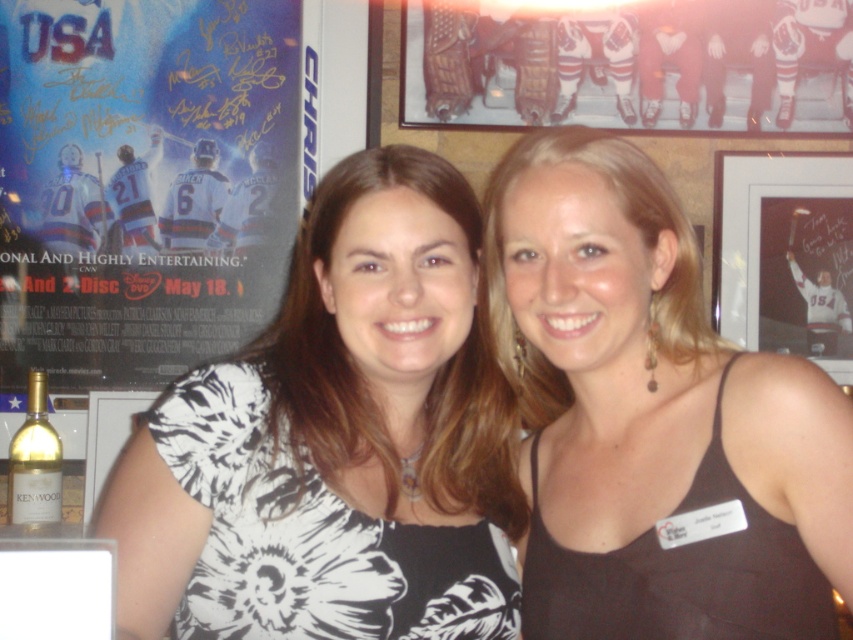
Between point (271, 541) and point (39, 374), which one is positioned in front?

Positioned in front is point (271, 541).

Which of these two, white floral dress at center or gold metallic bottle at lower left, stands taller?

white floral dress at center

The width and height of the screenshot is (853, 640). What are the coordinates of `white floral dress at center` in the screenshot? It's located at (335, 440).

Where is `white floral dress at center`? This screenshot has width=853, height=640. white floral dress at center is located at coordinates (335, 440).

Who is more distant from viewer, [773,499] or [212,188]?

The point [212,188] is behind.

Does point (692, 266) come behind point (287, 70)?

No, it is not.

Describe the element at coordinates (653, 417) in the screenshot. I see `black fabric tank top at center` at that location.

Locate an element on the screen. This screenshot has width=853, height=640. black fabric tank top at center is located at coordinates (653, 417).

Which is behind, point (389, 396) or point (804, 253)?

Point (804, 253)

Is white floral dress at center smaller than matte black frame at upper right?

No.

Between point (433, 320) and point (729, 230), which one is positioned in front?

Positioned in front is point (433, 320).

In order to click on white floral dress at center in this screenshot , I will do `click(335, 440)`.